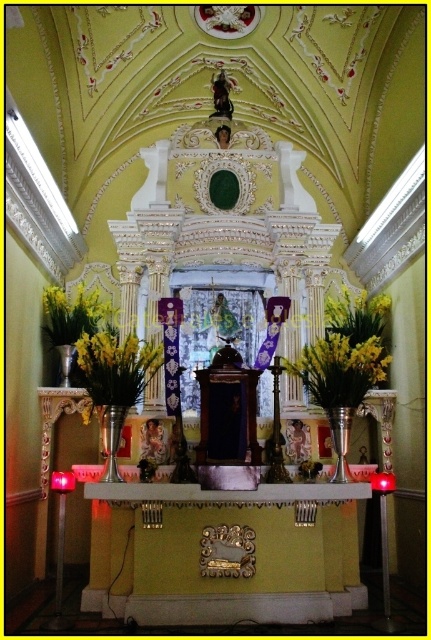
You are standing in front of the altar and want to place a small offering. The offering must be placed closer to you than the yellow matte vase at center. Can you place it near the yellow matte flowers at center?

Yes, because the yellow matte flowers at center are closer to you than the yellow matte vase at center, so placing the offering near them would satisfy the requirement.

You are an altar caretaker who needs to replace the yellow matte flowers at center and the yellow matte vase at center. Which one should you replace first if you want to start with the taller object?

The yellow matte flowers at center is much taller than the yellow matte vase at center, so you should replace the yellow matte flowers at center first.

You are standing at the entrance of the church facing the altar. There are two points marked on the altar, one at coordinates point (316, 372) and another at point (133, 369). Which point is closer to you?

Point (133, 369) is closer to you because it is less further to the viewer than point (316, 372).